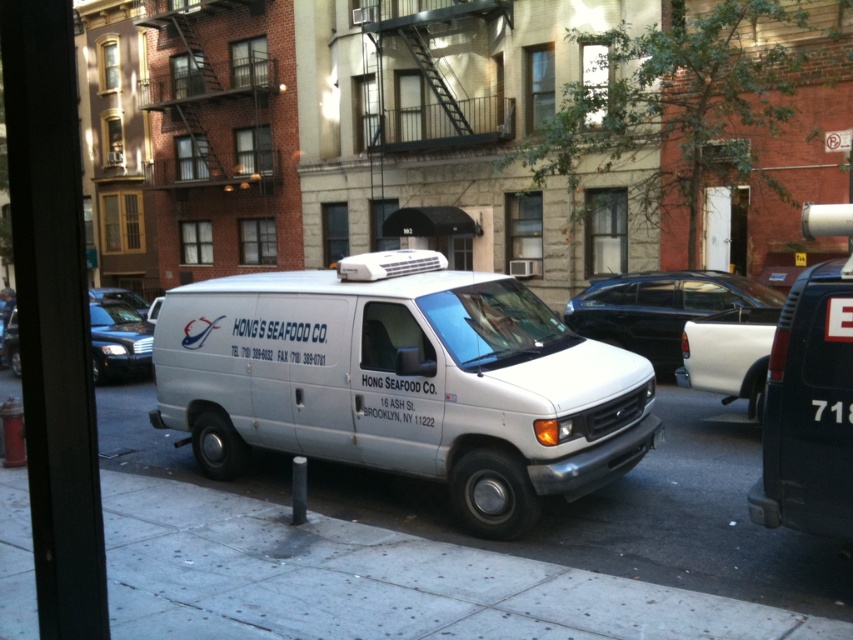
You are a GUI agent. You are given a task and a screenshot of the screen. Output one action in this format:
    pyautogui.click(x=<x>, y=<y>)
    Task: Click on the white matte van at center
    This screenshot has width=853, height=640.
    Given the screenshot: What is the action you would take?
    pyautogui.click(x=402, y=381)

Between white matte van at center and matte white van at left, which one is positioned higher?

Positioned higher is matte white van at left.

You are a GUI agent. You are given a task and a screenshot of the screen. Output one action in this format:
    pyautogui.click(x=<x>, y=<y>)
    Task: Click on the white matte van at center
    The width and height of the screenshot is (853, 640).
    Given the screenshot: What is the action you would take?
    pyautogui.click(x=402, y=381)

Measure the distance between white matte van at center and camera.

The distance of white matte van at center from camera is 5.80 meters.

Consider the image. Which is more to the left, white matte van at center or gray concrete pavement at center?

gray concrete pavement at center

Measure the distance between white matte van at center and camera.

white matte van at center and camera are 19.04 feet apart.

This screenshot has width=853, height=640. I want to click on white matte van at center, so click(402, 381).

Can you confirm if gray concrete pavement at center is positioned above matte white van at left?

Actually, gray concrete pavement at center is below matte white van at left.

Between point (602, 508) and point (149, 360), which one is positioned in front?

Point (602, 508)

Is point (656, 580) farther from viewer compared to point (10, 326)?

No, it is not.

Locate an element on the screen. The width and height of the screenshot is (853, 640). gray concrete pavement at center is located at coordinates (637, 516).